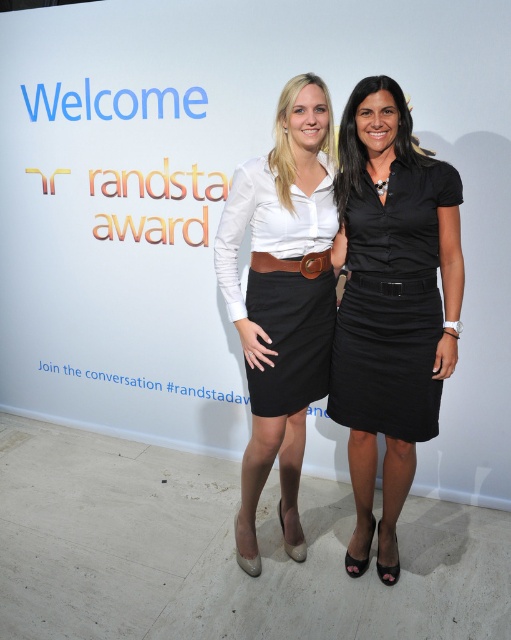
Question: In this image, where is black satin skirt at right located relative to brown leather belt at center?

Choices:
 (A) left
 (B) right

Answer: (B)

Question: Among these points, which one is nearest to the camera?

Choices:
 (A) (387, 288)
 (B) (387, 276)

Answer: (B)

Question: Based on their relative distances, which object is nearer to the black leather belt at center?

Choices:
 (A) black satin skirt at right
 (B) matte white blouse at center

Answer: (A)

Question: Which point is closer to the camera?

Choices:
 (A) matte white blouse at center
 (B) black satin skirt at right

Answer: (A)

Question: Does matte white blouse at center appear on the right side of black leather belt at center?

Choices:
 (A) no
 (B) yes

Answer: (A)

Question: Observing the image, what is the correct spatial positioning of brown leather belt at center in reference to black leather belt at center?

Choices:
 (A) right
 (B) left

Answer: (B)